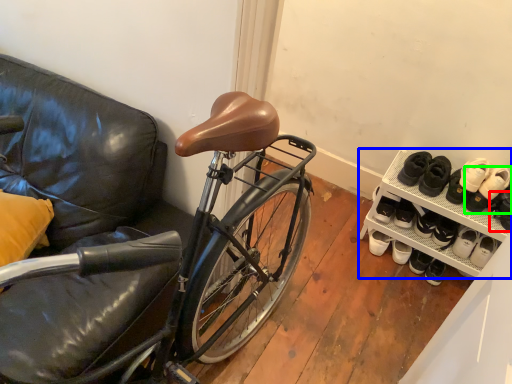
Question: Which object is the closest to the shoe (highlighted by a red box)? Choose among these: cabinetry (highlighted by a blue box) or footwear (highlighted by a green box).

Choices:
 (A) cabinetry
 (B) footwear

Answer: (B)